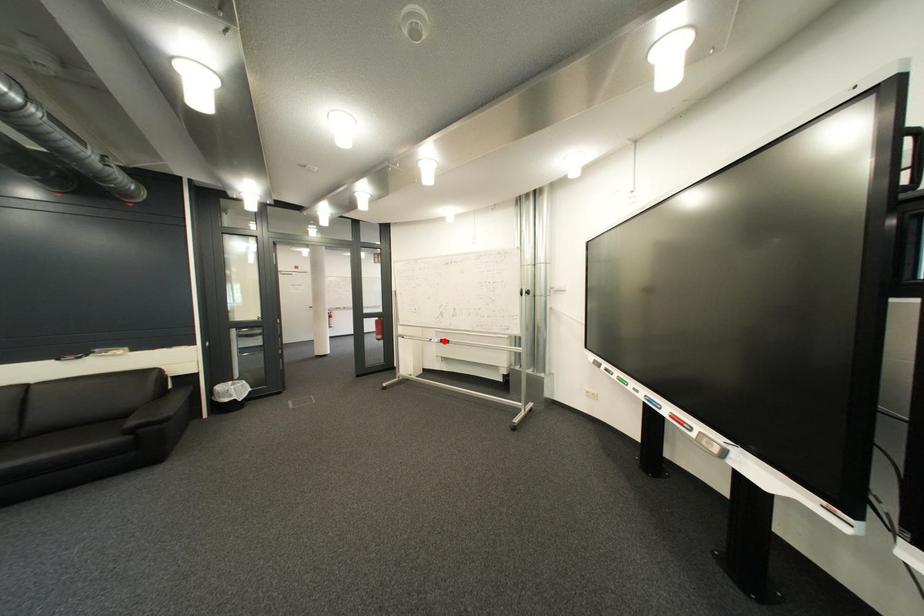
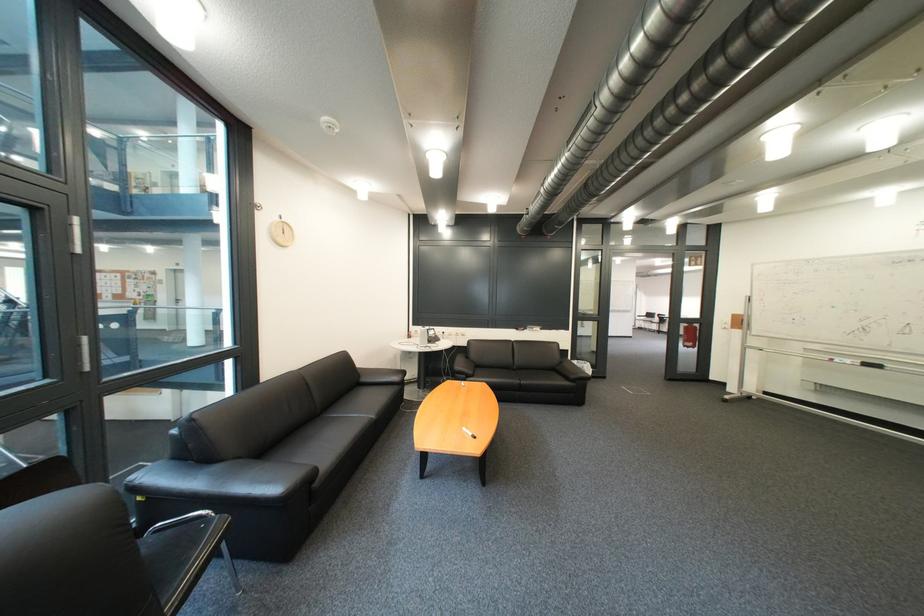
Locate, in the second image, the point that corresponds to the highlighted location in the first image.

(845, 361)